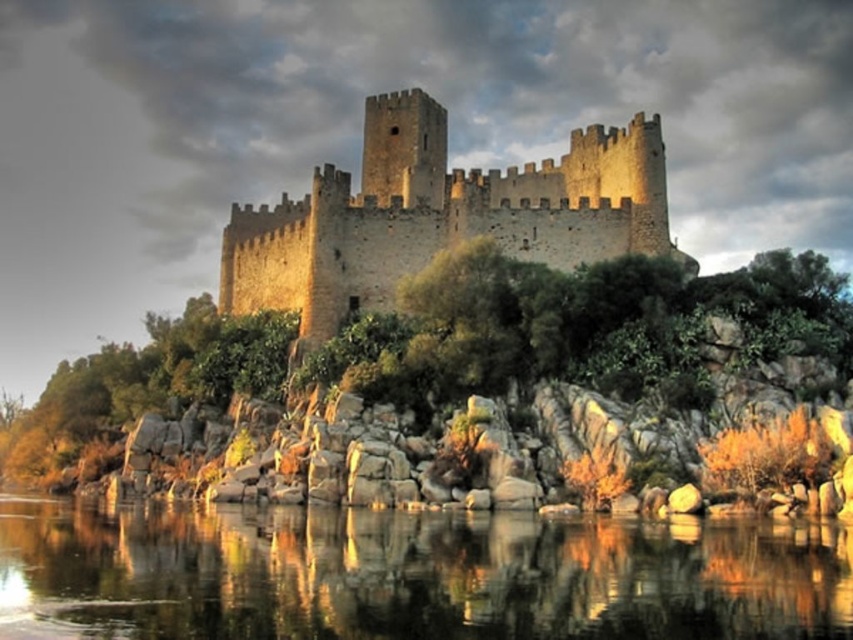
Question: Which point appears closest to the camera in this image?

Choices:
 (A) (792, 577)
 (B) (421, 266)

Answer: (A)

Question: Does transparent water at lower center appear on the right side of brown stone castle at center?

Choices:
 (A) yes
 (B) no

Answer: (B)

Question: Which of the following is the closest to the observer?

Choices:
 (A) brown stone castle at center
 (B) transparent water at lower center

Answer: (B)

Question: In this image, where is transparent water at lower center located relative to brown stone castle at center?

Choices:
 (A) above
 (B) below

Answer: (B)

Question: Which point appears closest to the camera in this image?

Choices:
 (A) (257, 269)
 (B) (836, 588)

Answer: (B)

Question: Is the position of transparent water at lower center less distant than that of brown stone castle at center?

Choices:
 (A) yes
 (B) no

Answer: (A)